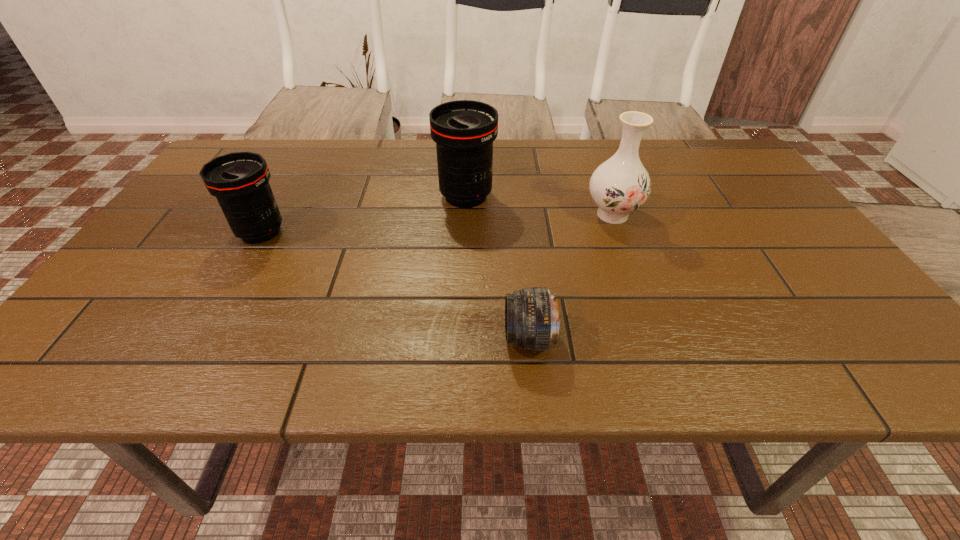
Where is `vacant space located 0.330m at the front element of the third object from left to right`? vacant space located 0.330m at the front element of the third object from left to right is located at coordinates (334, 338).

Where is `vacant space located at the front element of the third object from left to right`? Image resolution: width=960 pixels, height=540 pixels. vacant space located at the front element of the third object from left to right is located at coordinates (360, 338).

Where is `vacant region located 0.170m at the front element of the third object from left to right`? Image resolution: width=960 pixels, height=540 pixels. vacant region located 0.170m at the front element of the third object from left to right is located at coordinates (417, 338).

Locate an element on the screen. This screenshot has height=540, width=960. object that is at the near edge is located at coordinates (532, 322).

The height and width of the screenshot is (540, 960). I want to click on vacant area at the far edge of the desktop, so click(521, 154).

Image resolution: width=960 pixels, height=540 pixels. Identify the location of free point at the near edge. (695, 349).

This screenshot has height=540, width=960. Identify the location of free space at the left edge. (182, 211).

You are a GUI agent. You are given a task and a screenshot of the screen. Output one action in this format:
    pyautogui.click(x=<x>, y=<y>)
    Task: Click on the vacant region at the right edge of the desktop
    The width and height of the screenshot is (960, 540).
    Given the screenshot: What is the action you would take?
    pyautogui.click(x=763, y=211)

Where is `vacant area that lies between the tallest telephoto lens and the leftmost object`? The image size is (960, 540). vacant area that lies between the tallest telephoto lens and the leftmost object is located at coordinates (363, 214).

The image size is (960, 540). Find the location of `free space between the second telephoto lens from left to right and the nearest telephoto lens`. free space between the second telephoto lens from left to right and the nearest telephoto lens is located at coordinates (497, 267).